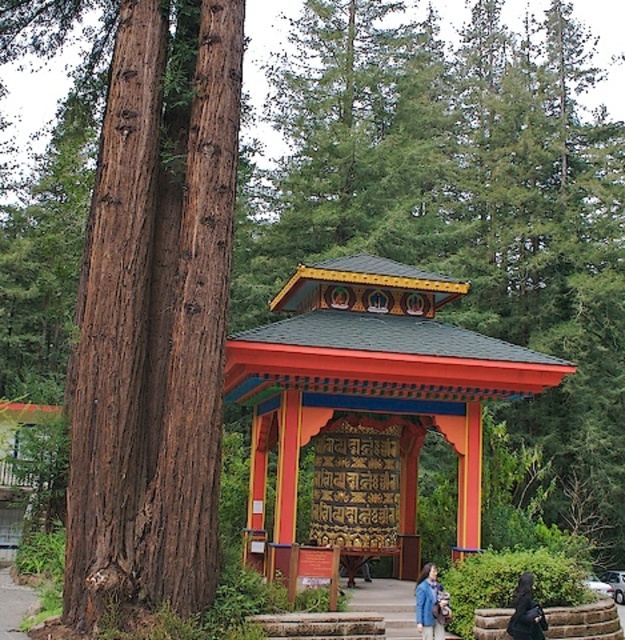
You are a hiker who has just arrived at the pavilion and notices both the blue denim jacket at lower right and the black fabric coat at lower right. Which one is bigger in size?

The blue denim jacket at lower right is larger in size compared to the black fabric coat at lower right.

You are standing in front of the pavilion and want to take a photo that includes both point (262, 328) and point (422, 627). Which point is closer to the camera?

Point (262, 328) is further to the camera than point (422, 627), so point (422, 627) is closer to the camera.